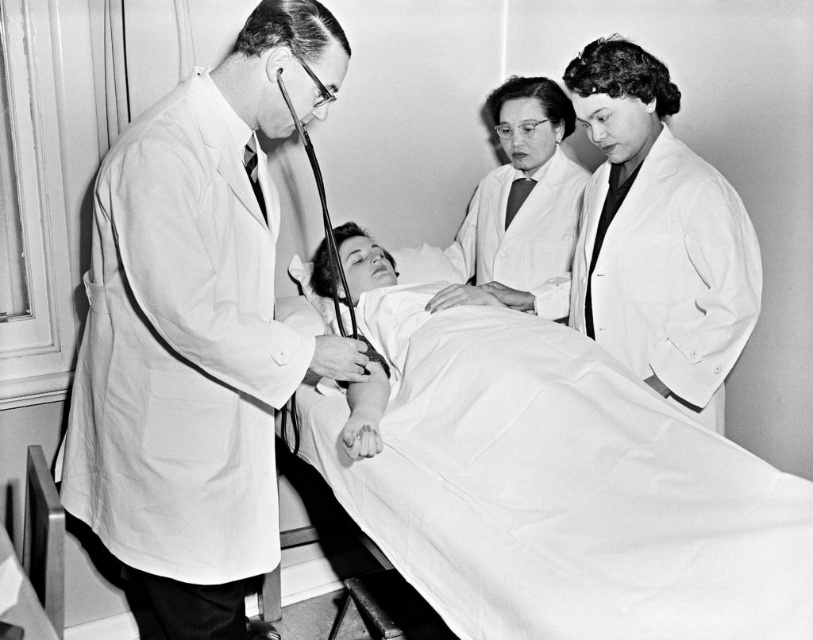
In the medical scene, there is a white lab coat at left and a metallic smooth stethoscope at center. Which object is positioned more to the left?

The white lab coat at left is positioned more to the left than the metallic smooth stethoscope at center.

You are a medical student observing the scene. You notice two points marked in the image. Which point is closer to you, point (414, 448) or point (90, 291)?

Point (414, 448) is further to the viewer than point (90, 291), so point (90, 291) is closer to you.